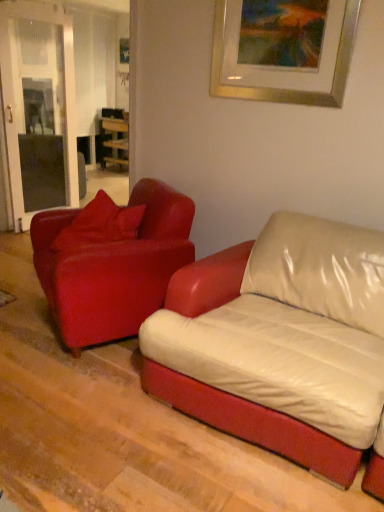
Where is `free space in front of matte red leather couch at left, positioned as the first studio couch in right-to-left order`? free space in front of matte red leather couch at left, positioned as the first studio couch in right-to-left order is located at coordinates (83, 400).